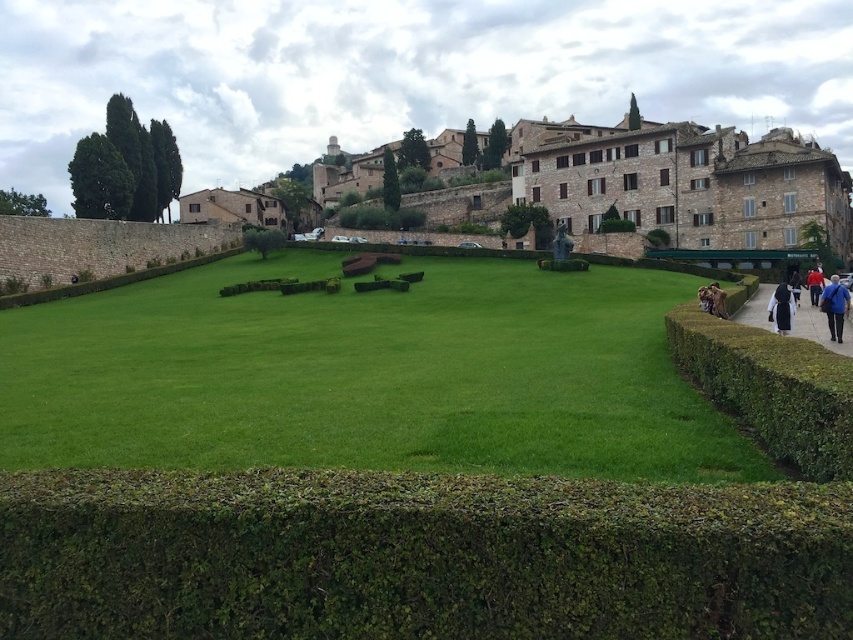
Can you confirm if green leafy hedge at right is positioned to the right of black cloth at lower right?

Incorrect, green leafy hedge at right is not on the right side of black cloth at lower right.

Does green leafy hedge at right appear on the left side of black cloth at lower right?

Yes, green leafy hedge at right is to the left of black cloth at lower right.

Is point (686, 321) less distant than point (779, 321)?

Yes, it is.

What are the coordinates of `green leafy hedge at right` in the screenshot? It's located at (770, 388).

Which is above, blue fabric bag at lower right or brown leather jacket at right?

blue fabric bag at lower right is above.

In the scene shown: Between blue fabric bag at lower right and brown leather jacket at right, which one appears on the left side from the viewer's perspective?

From the viewer's perspective, brown leather jacket at right appears more on the left side.

Where is `blue fabric bag at lower right`? The width and height of the screenshot is (853, 640). blue fabric bag at lower right is located at coordinates (834, 307).

Who is positioned more to the right, green grass at center or brown paved path at lower right?

A: From the viewer's perspective, brown paved path at lower right appears more on the right side.

Who is lower down, green grass at center or brown paved path at lower right?

green grass at center is below.

Does point (328, 349) lie behind point (834, 342)?

Yes, it is behind point (834, 342).

Where is `green grass at center`? green grass at center is located at coordinates (367, 374).